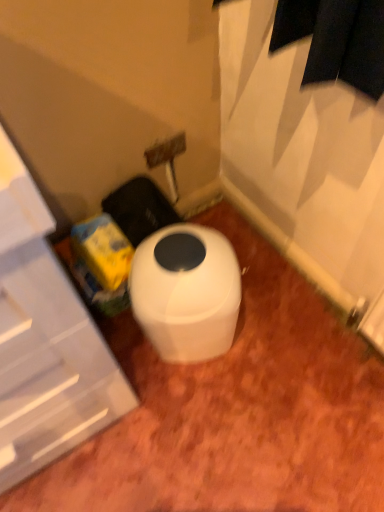
Question: Does white glossy toilet at center touch white plastic cabinet at left?

Choices:
 (A) yes
 (B) no

Answer: (B)

Question: Does white glossy toilet at center appear on the left side of white plastic cabinet at left?

Choices:
 (A) no
 (B) yes

Answer: (A)

Question: Can you confirm if white glossy toilet at center is thinner than white plastic cabinet at left?

Choices:
 (A) no
 (B) yes

Answer: (B)

Question: Would you consider white glossy toilet at center to be distant from white plastic cabinet at left?

Choices:
 (A) yes
 (B) no

Answer: (B)

Question: From the image's perspective, is white glossy toilet at center below white plastic cabinet at left?

Choices:
 (A) no
 (B) yes

Answer: (B)

Question: Considering the relative sizes of white glossy toilet at center and white plastic cabinet at left in the image provided, is white glossy toilet at center smaller than white plastic cabinet at left?

Choices:
 (A) no
 (B) yes

Answer: (B)

Question: Is white glossy toilet at center completely or partially inside white plastic cabinet at left?

Choices:
 (A) no
 (B) yes

Answer: (A)

Question: Is white plastic cabinet at left next to white glossy toilet at center and touching it?

Choices:
 (A) yes
 (B) no

Answer: (B)

Question: Considering the relative sizes of white plastic cabinet at left and white glossy toilet at center in the image provided, is white plastic cabinet at left shorter than white glossy toilet at center?

Choices:
 (A) yes
 (B) no

Answer: (B)

Question: Is the depth of white plastic cabinet at left greater than that of white glossy toilet at center?

Choices:
 (A) yes
 (B) no

Answer: (B)

Question: Is white plastic cabinet at left bigger than white glossy toilet at center?

Choices:
 (A) yes
 (B) no

Answer: (A)

Question: Is white plastic cabinet at left to the right of white glossy toilet at center from the viewer's perspective?

Choices:
 (A) yes
 (B) no

Answer: (B)

Question: In terms of height, does white plastic cabinet at left look taller or shorter compared to white glossy toilet at center?

Choices:
 (A) short
 (B) tall

Answer: (B)